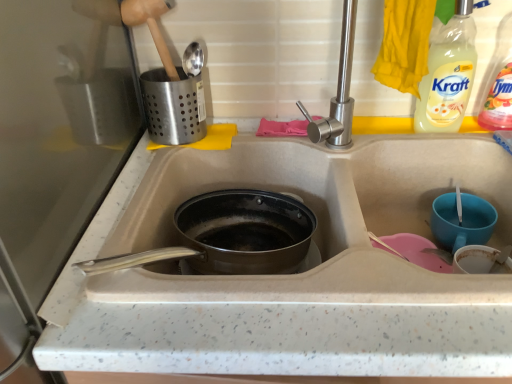
At what (x,y) coordinates should I click in order to perform the action: click on vacant space that is to the left of clear plastic bottle at upper right, the 1th bottle positioned from the left. Please return your answer as a coordinate pair (x, y). Looking at the image, I should click on (370, 140).